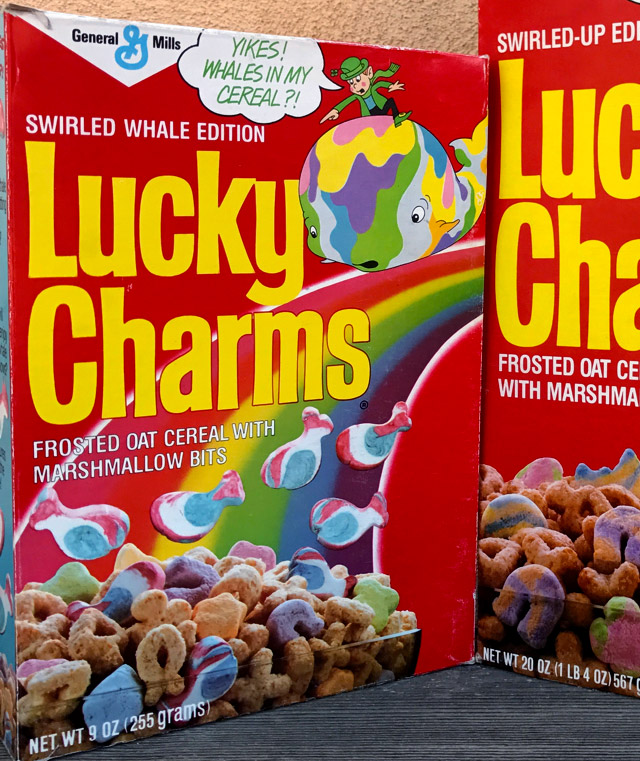
Identify the location of box of cereal. The height and width of the screenshot is (761, 640). (237, 367), (588, 428).